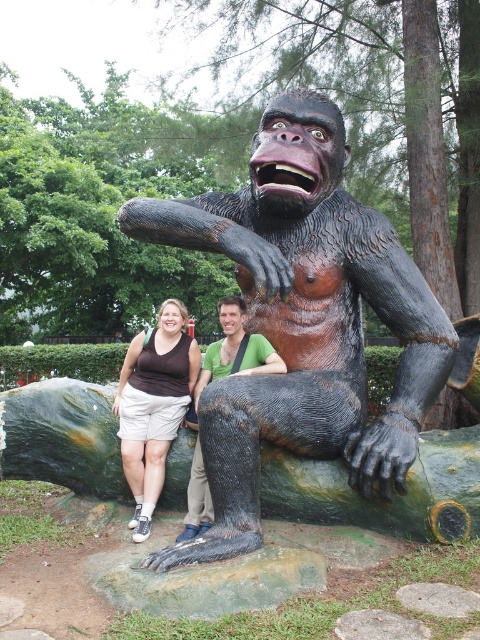
Can you confirm if brown cotton shorts at lower left is shorter than green matte shirt at center?

In fact, brown cotton shorts at lower left may be taller than green matte shirt at center.

Can you confirm if brown cotton shorts at lower left is positioned above green matte shirt at center?

No.

Is point (179, 356) behind point (228, 339)?

Yes, point (179, 356) is farther from viewer.

Find the location of a particular element. The width and height of the screenshot is (480, 640). brown cotton shorts at lower left is located at coordinates (154, 404).

Which is more to the left, shiny bronze statue at center or green matte shirt at center?

green matte shirt at center

Is point (382, 442) closer to camera compared to point (233, 305)?

Yes, it is in front of point (233, 305).

Is point (250, 472) closer to camera compared to point (197, 396)?

Yes, point (250, 472) is closer to viewer.

The height and width of the screenshot is (640, 480). In order to click on shiny bronze statue at center in this screenshot , I will do `click(302, 321)`.

Which is in front, point (285, 147) or point (140, 468)?

Point (285, 147) is in front.

At what (x,y) coordinates should I click in order to perform the action: click on shiny bronze statue at center. Please return your answer as a coordinate pair (x, y). Looking at the image, I should click on (302, 321).